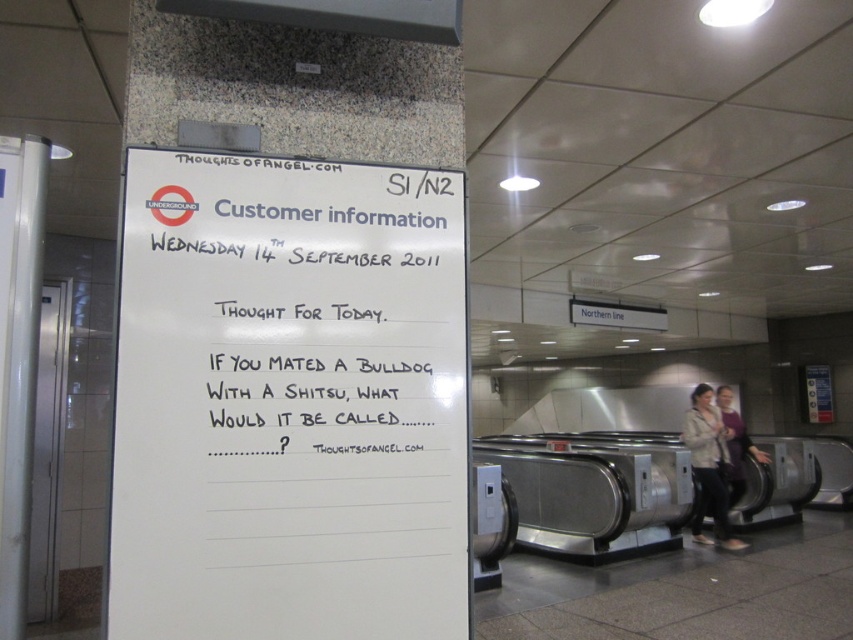
You are a passenger on the Northern Line platform at London Underground. You see a whiteboard on a pillar with some text. There is a white paper at upper left located at point (288, 401). Is the white paper at upper left closer to the top edge or the bottom edge of the whiteboard?

The white paper at upper left located at point (288, 401) is closer to the top edge of the whiteboard.

You are a commuter at the Northern Line platform and notice a whiteboard with a question about mating a Bulldog and Shitsu. You also see a white paper at upper left and a light beige jacket at lower right. According to the spatial arrangement, which object is positioned to the left of the other?

The white paper at upper left is to the left of the light beige jacket at lower right.